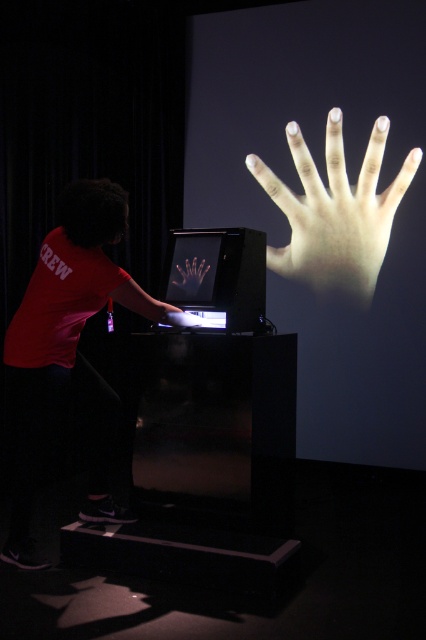
Is point (69, 321) farther from viewer compared to point (196, 291)?

That is False.

Does matte red shirt at left come behind translucent plastic hand at center?

No, it is in front of translucent plastic hand at center.

Does point (14, 404) come behind point (184, 276)?

Yes, it is.

What are the coordinates of `matte red shirt at left` in the screenshot? It's located at (68, 355).

Who is more forward, (x=62, y=291) or (x=368, y=228)?

Point (x=62, y=291)

Who is positioned more to the left, matte red shirt at left or smooth skin hand at center?

matte red shirt at left

Is point (11, 337) behind point (305, 241)?

That is False.

This screenshot has width=426, height=640. Find the location of `matte red shirt at left`. matte red shirt at left is located at coordinates (68, 355).

Can you confirm if smooth skin hand at center is bigger than translucent plastic hand at center?

Yes, smooth skin hand at center is bigger than translucent plastic hand at center.

Who is shorter, smooth skin hand at center or translucent plastic hand at center?

translucent plastic hand at center is shorter.

Who is more distant from viewer, (365, 211) or (186, 268)?

The point (365, 211) is more distant.

Find the location of a particular element. smooth skin hand at center is located at coordinates (336, 212).